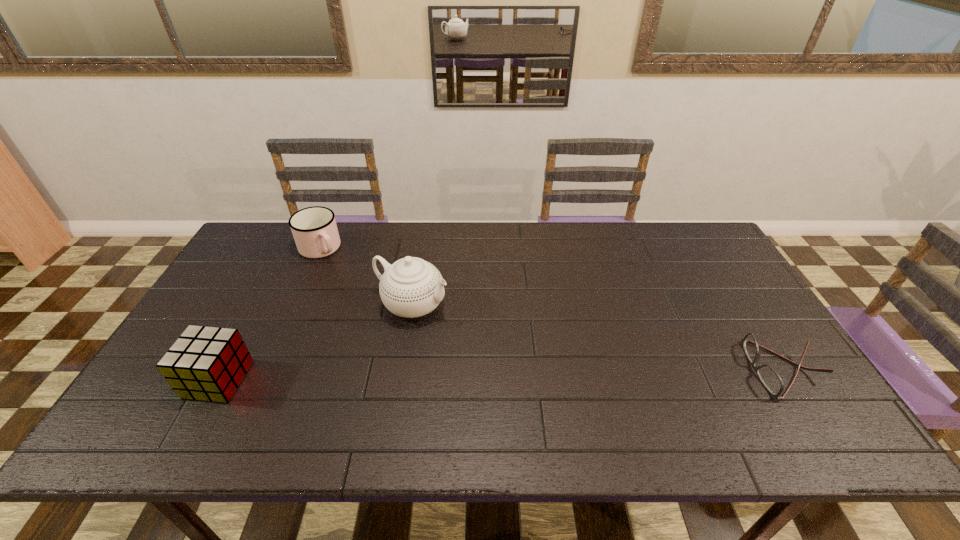
Locate an element on the screen. This screenshot has width=960, height=540. object positioned at the right edge is located at coordinates (771, 380).

Find the location of a particular element. This screenshot has height=540, width=960. object present at the near left corner is located at coordinates (205, 363).

Locate an element on the screen. The height and width of the screenshot is (540, 960). object that is at the near right corner is located at coordinates (771, 380).

This screenshot has width=960, height=540. In the image, there is a desktop. In order to click on vacant area at the far edge in this screenshot , I will do `click(588, 258)`.

In the image, there is a desktop. Where is `vacant space at the near edge`? This screenshot has width=960, height=540. vacant space at the near edge is located at coordinates (436, 387).

In the image, there is a desktop. Where is `vacant region at the right edge`? vacant region at the right edge is located at coordinates (696, 282).

This screenshot has width=960, height=540. I want to click on vacant space at the far left corner of the desktop, so click(x=259, y=224).

Image resolution: width=960 pixels, height=540 pixels. I want to click on free location at the far right corner, so click(x=696, y=227).

The height and width of the screenshot is (540, 960). What are the coordinates of `vacant space that's between the mug and the chinaware` in the screenshot? It's located at (366, 277).

Find the location of a particular element. vacant area that lies between the second object from right to left and the cube is located at coordinates (315, 342).